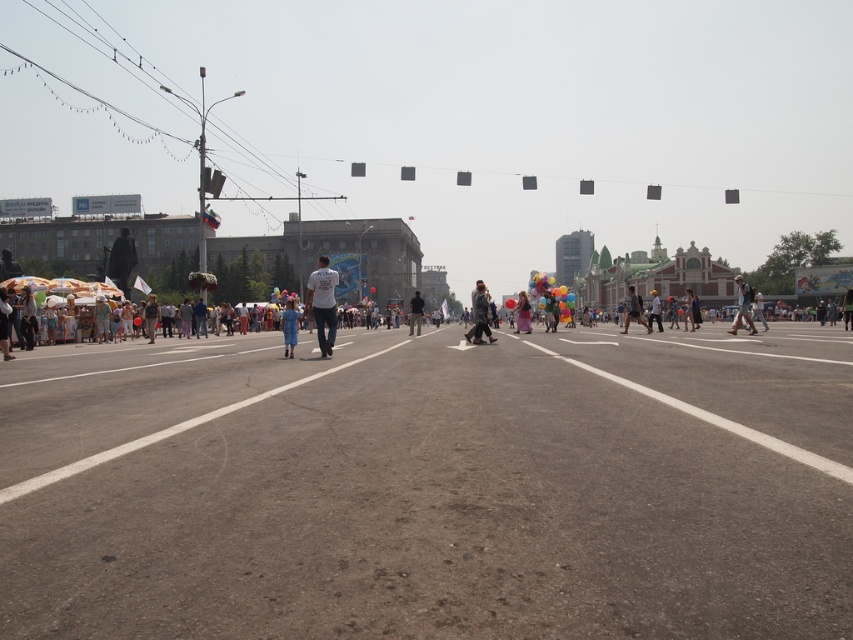
You are standing at the point with coordinates point (744, 282) and want to walk to the point with coordinates point (477, 337). Which direction should you move to reach your destination?

You should move forward because point (477, 337) is in front of point (744, 282).

You are a photographer trying to capture a candid shot of both the matte gray coat at center and denim shorts at center. Since you want to ensure both are fully visible in the frame, which object should you focus on to avoid cropping either?

The matte gray coat at center is not as tall as denim shorts at center, so focusing on the denim shorts at center ensures the taller object is fully captured, allowing the shorter matte gray coat at center to also fit within the frame.